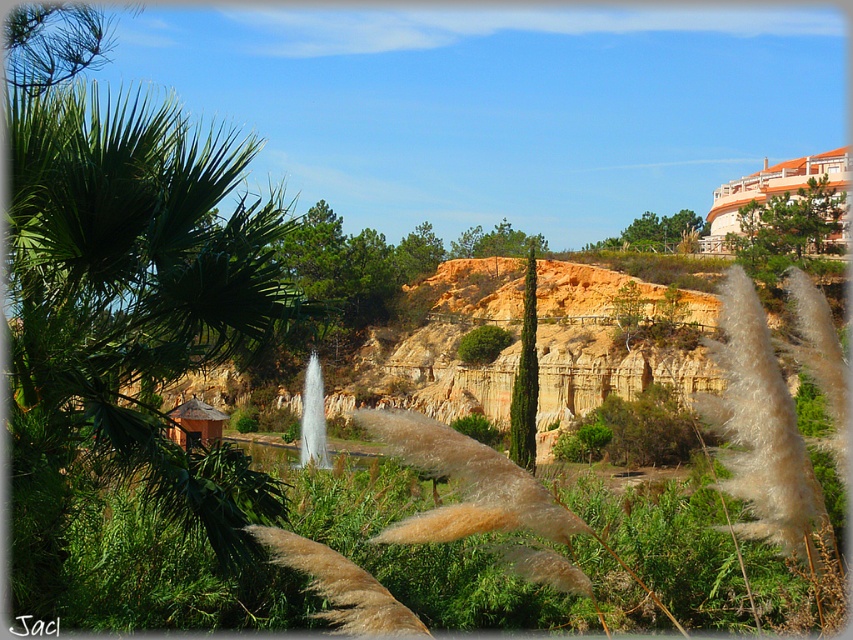
Question: From the image, what is the correct spatial relationship of green leafy palm tree at left in relation to green textured tree at upper right?

Choices:
 (A) right
 (B) left

Answer: (B)

Question: Among these points, which one is farthest from the camera?

Choices:
 (A) (529, 461)
 (B) (137, 401)
 (C) (566, 312)
 (D) (811, 208)

Answer: (D)

Question: Is green leafy palm tree at left below white glossy fountain at center?

Choices:
 (A) no
 (B) yes

Answer: (A)

Question: Which of the following is the closest to the observer?

Choices:
 (A) green leafy palm tree at left
 (B) green glossy cypress at center
 (C) white glossy fountain at center
 (D) green matte tree at center

Answer: (A)

Question: Is green glossy cypress at center bigger than green matte tree at center?

Choices:
 (A) yes
 (B) no

Answer: (A)

Question: Among these objects, which one is farthest from the camera?

Choices:
 (A) green glossy cypress at center
 (B) white glossy fountain at center
 (C) orange clay hillside at center
 (D) green leafy palm tree at left

Answer: (C)